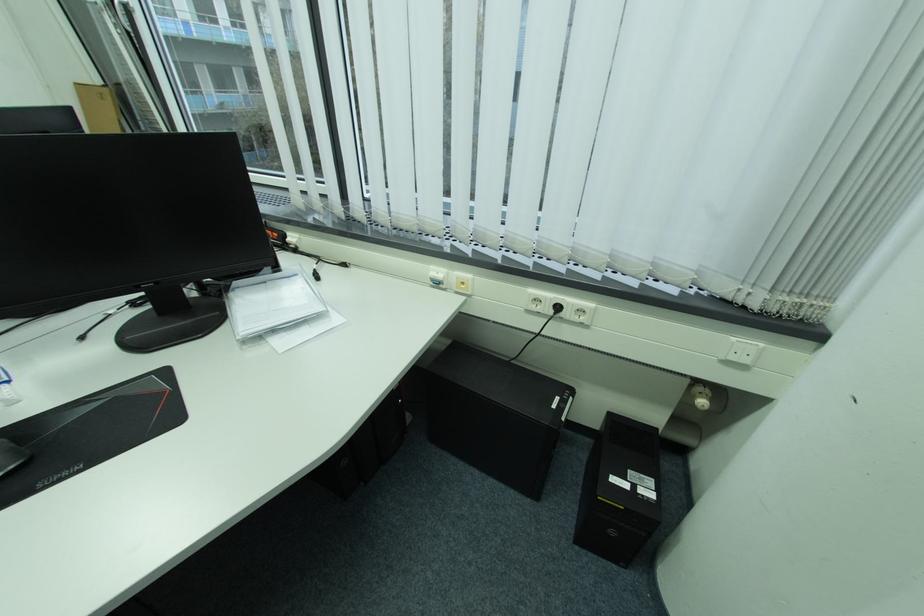
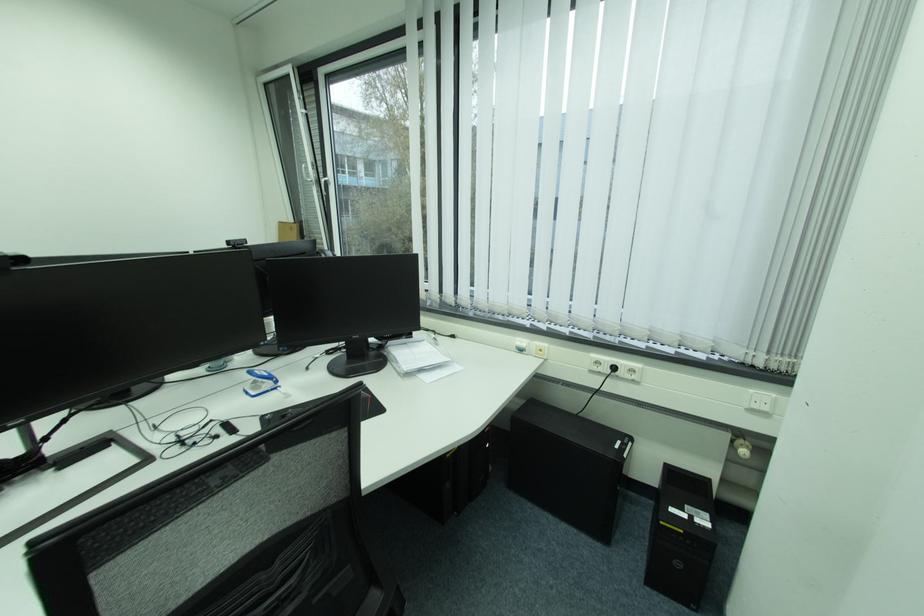
In the second image, find the point that corresponds to [565,309] in the first image.

(623, 369)